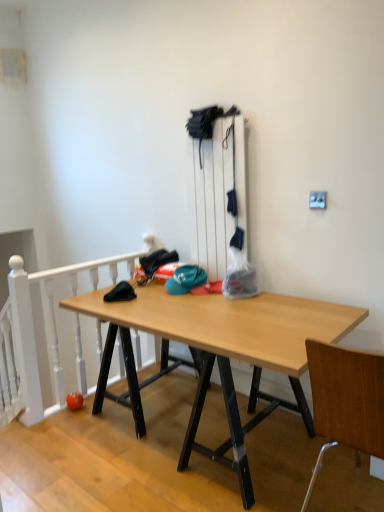
Describe the element at coordinates (346, 401) in the screenshot. The width and height of the screenshot is (384, 512). I see `wooden at right` at that location.

Measure the distance between wooden desk at center and camera.

1.55 meters.

Where is `wooden at right`? This screenshot has width=384, height=512. wooden at right is located at coordinates (346, 401).

How many degrees apart are the facing directions of wooden at right and white painted wood at left?

The facing directions of wooden at right and white painted wood at left are 90 degrees apart.

Considering the sizes of wooden at right and white painted wood at left in the image, is wooden at right wider or thinner than white painted wood at left?

In the image, wooden at right appears to be wider than white painted wood at left.

Considering the sizes of objects wooden at right and white painted wood at left in the image provided, who is bigger, wooden at right or white painted wood at left?

wooden at right.

How different are the orientations of teal fabric cap at center and wooden desk at center in degrees?

92.3 degrees separate the facing orientations of teal fabric cap at center and wooden desk at center.

Would you say teal fabric cap at center contains wooden desk at center?

No.

Between teal fabric cap at center and wooden desk at center, which one has larger width?

wooden desk at center is wider.

From a real-world perspective, is teal fabric cap at center on wooden desk at center?

Yes, from a real-world perspective, teal fabric cap at center is over wooden desk at center

How many degrees apart are the facing directions of wooden desk at center and white painted wood at left?

They differ by 178 degrees in their facing directions.

From the image's perspective, is wooden desk at center under white painted wood at left?

Indeed, from the image's perspective, wooden desk at center is shown beneath white painted wood at left.

Which is nearer, (304, 352) or (21, 379)?

The point (304, 352) is more forward.

Is wooden desk at center oriented away from white painted wood at left?

That's not correct — wooden desk at center is not looking away from white painted wood at left.

Is point (136, 414) positioned behind point (355, 432)?

That is True.

Is wooden desk at center shorter than wooden at right?

Correct, wooden desk at center is not as tall as wooden at right.

How many degrees apart are the facing directions of wooden desk at center and wooden at right?

87.7 degrees.

Find the location of `chair above the wooden desk at center (from a real-world perspective)`. chair above the wooden desk at center (from a real-world perspective) is located at coordinates (346, 401).

Considering the relative sizes of wooden desk at center and teal fabric cap at center in the image provided, is wooden desk at center thinner than teal fabric cap at center?

In fact, wooden desk at center might be wider than teal fabric cap at center.

Is point (206, 452) more distant than point (178, 279)?

No, it is in front of (178, 279).

Find the location of `hat that is on the right side of wooden desk at center`. hat that is on the right side of wooden desk at center is located at coordinates (186, 279).

Can you see wooden desk at center touching teal fabric cap at center?

No, wooden desk at center is not beside teal fabric cap at center.

Which of these two, white painted wood at left or teal fabric cap at center, stands shorter?

teal fabric cap at center is shorter.

Is white painted wood at left aimed at teal fabric cap at center?

Yes, white painted wood at left is turned towards teal fabric cap at center.

Can we say white painted wood at left lies outside teal fabric cap at center?

That's correct, white painted wood at left is outside of teal fabric cap at center.

What's the angular difference between white painted wood at left and teal fabric cap at center's facing directions?

white painted wood at left and teal fabric cap at center are facing 90 degrees away from each other.

Is white painted wood at left at the back of teal fabric cap at center?

No, teal fabric cap at center's orientation is not away from white painted wood at left.

Is teal fabric cap at center further to camera compared to white painted wood at left?

Yes, teal fabric cap at center is further from the camera.

From a real-world perspective, between teal fabric cap at center and white painted wood at left, who is vertically higher?

teal fabric cap at center.

From the image's perspective, is teal fabric cap at center on top of white painted wood at left?

Yes, from the image's perspective, teal fabric cap at center is above white painted wood at left.

Find the location of a particular element. This screenshot has height=512, width=384. rail that is above the wooden at right (from the image's perspective) is located at coordinates 34,333.

This screenshot has height=512, width=384. In order to click on desk in front of the teal fabric cap at center in this screenshot , I will do `click(220, 353)`.

In the scene shown: Based on their spatial positions, is white painted wood at left or wooden desk at center further from wooden at right?

The object further to wooden at right is white painted wood at left.

Looking at this image, based on their spatial positions, is teal fabric cap at center or white painted wood at left further from wooden desk at center?

white painted wood at left lies further to wooden desk at center than the other object.

Considering their positions, is teal fabric cap at center positioned closer to wooden desk at center than wooden at right?

teal fabric cap at center.

When comparing their distances from wooden at right, does wooden desk at center or teal fabric cap at center seem closer?

Among the two, wooden desk at center is located nearer to wooden at right.

From the picture: From the image, which object appears to be farther from teal fabric cap at center, white painted wood at left or wooden desk at center?

white painted wood at left lies further to teal fabric cap at center than the other object.

Estimate the real-world distances between objects in this image. Which object is closer to teal fabric cap at center, wooden desk at center or wooden at right?

Based on the image, wooden desk at center appears to be nearer to teal fabric cap at center.

Considering their positions, is white painted wood at left positioned closer to wooden at right than teal fabric cap at center?

Among the two, teal fabric cap at center is located nearer to wooden at right.

When comparing their distances from white painted wood at left, does teal fabric cap at center or wooden desk at center seem further?

Among the two, teal fabric cap at center is located further to white painted wood at left.

Image resolution: width=384 pixels, height=512 pixels. Identify the location of rail between wooden desk at center and teal fabric cap at center from front to back. (34, 333).

Locate an element on the screen. The width and height of the screenshot is (384, 512). chair between wooden desk at center and teal fabric cap at center along the z-axis is located at coordinates (346, 401).

This screenshot has height=512, width=384. Identify the location of chair between wooden desk at center and white painted wood at left along the z-axis. (346, 401).

Image resolution: width=384 pixels, height=512 pixels. Identify the location of hat located between white painted wood at left and wooden at right in the left-right direction. (x=186, y=279).